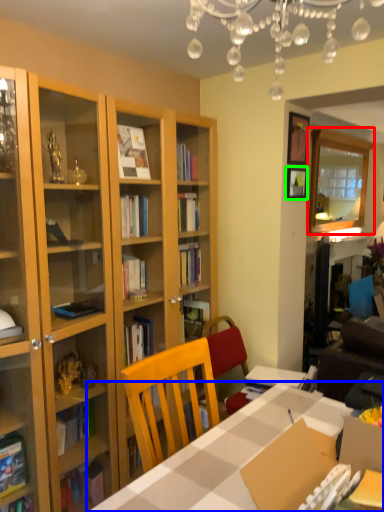
Question: Which is farther away from glass door (highlighted by a red box)? table (highlighted by a blue box) or picture frame (highlighted by a green box)?

Choices:
 (A) table
 (B) picture frame

Answer: (A)